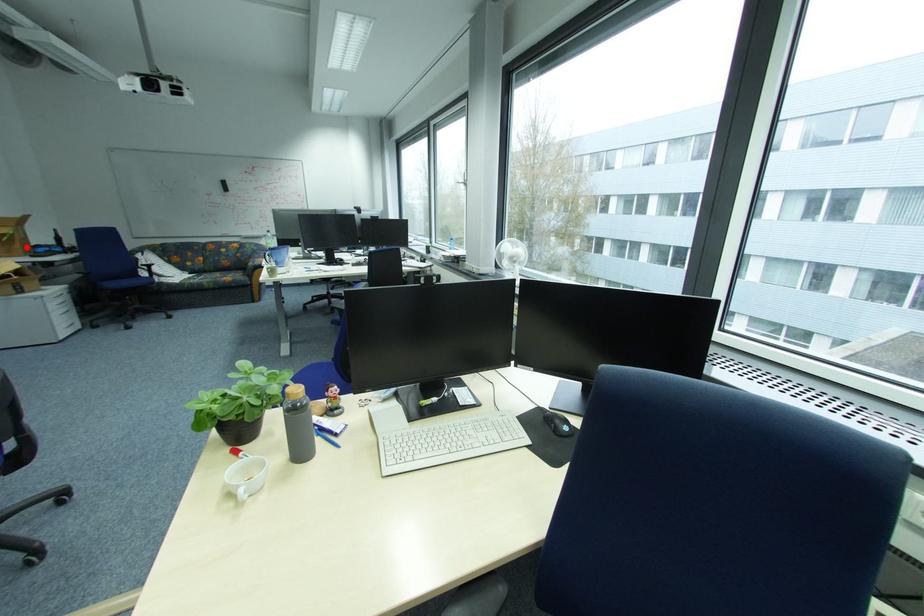
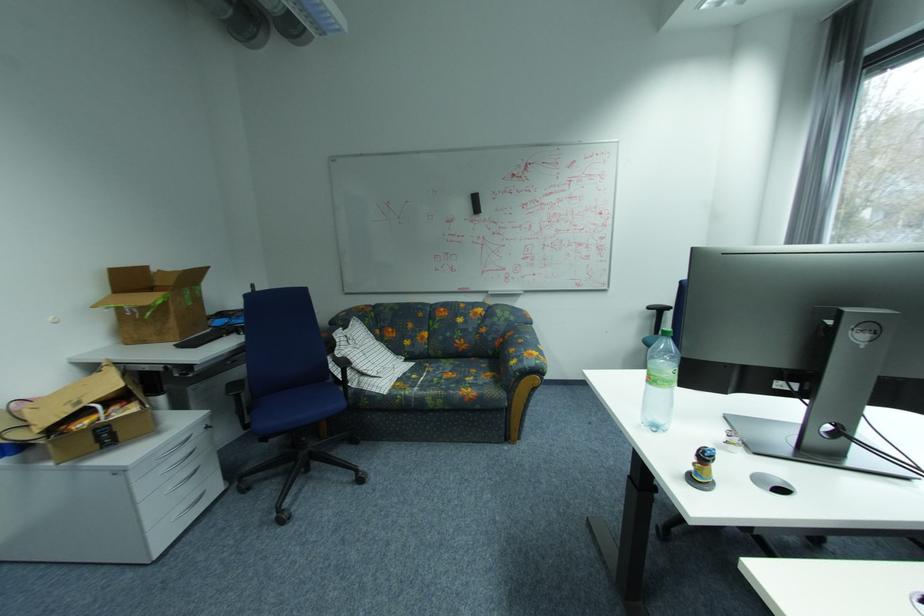
Question: I am providing you with two images of the same scene from different viewpoints. A red point is marked on the first image. Is the red point's position out of view in image 2?

Choices:
 (A) Yes
 (B) No

Answer: (B)